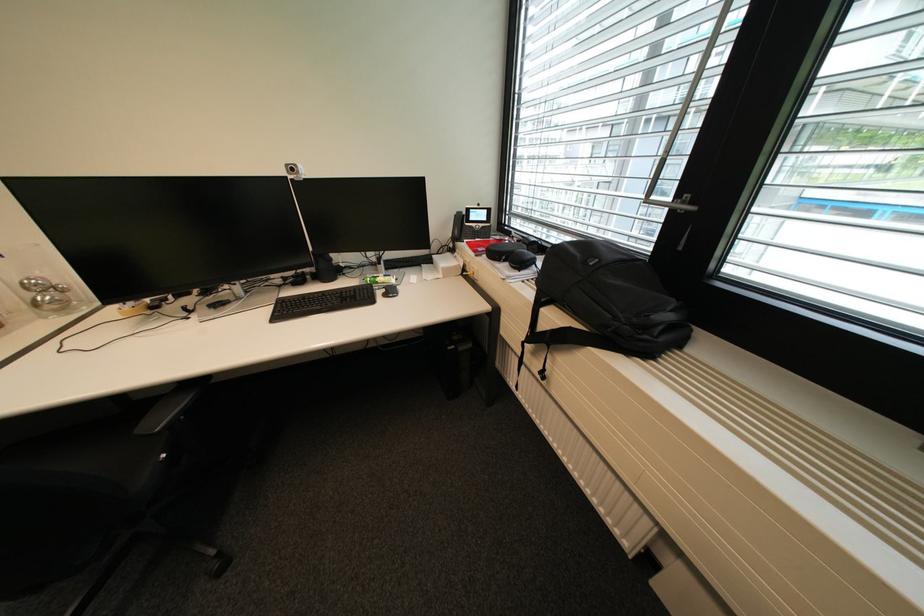
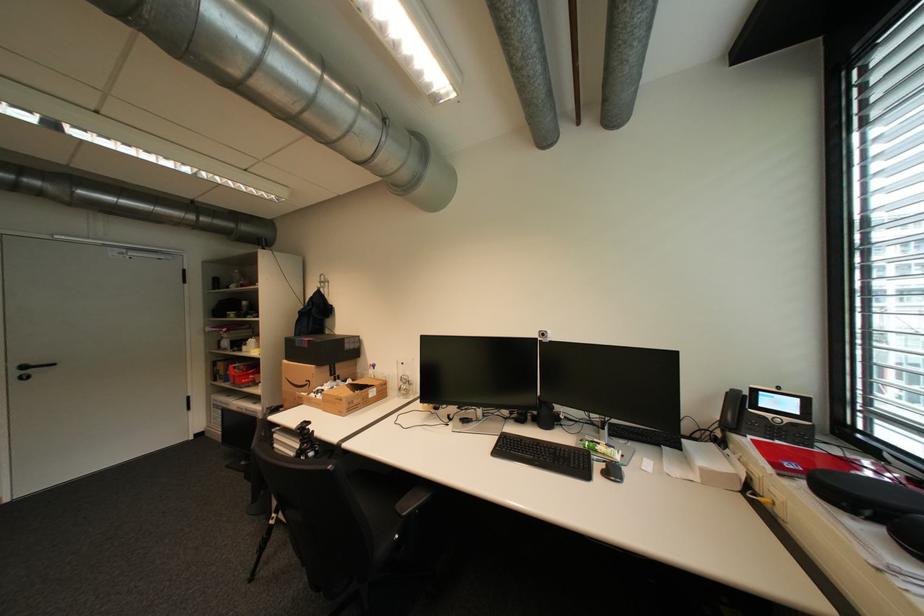
Locate, in the second image, the point that corresponds to (x=387, y=293) in the first image.

(606, 467)